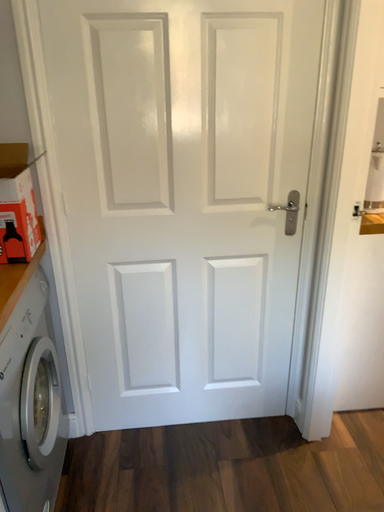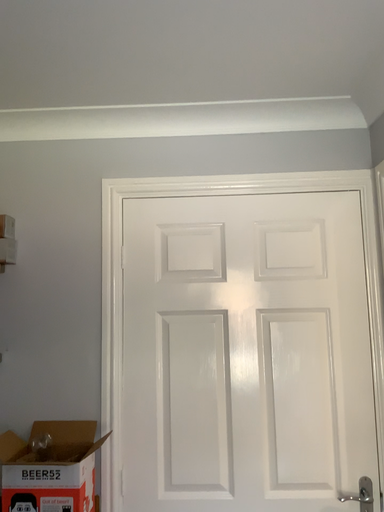
Question: How did the camera likely rotate when shooting the video?

Choices:
 (A) rotated right
 (B) rotated left

Answer: (B)